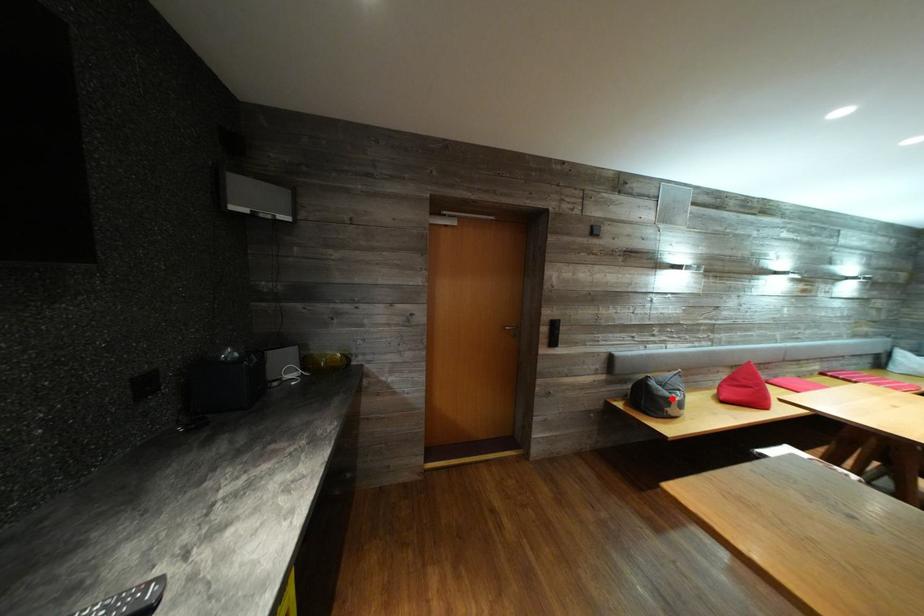
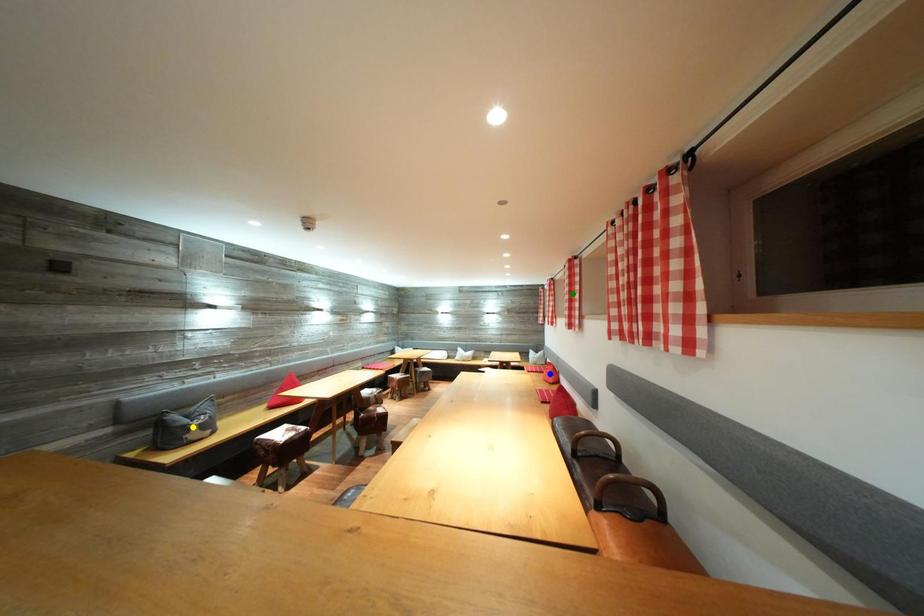
Question: I am providing you with two images of the same scene from different viewpoints. A red point is marked on the first image. You are given multiple points on the second image. Which spot in image 2 lines up with the point in image 1?

Choices:
 (A) yellow point
 (B) green point
 (C) blue point

Answer: (A)